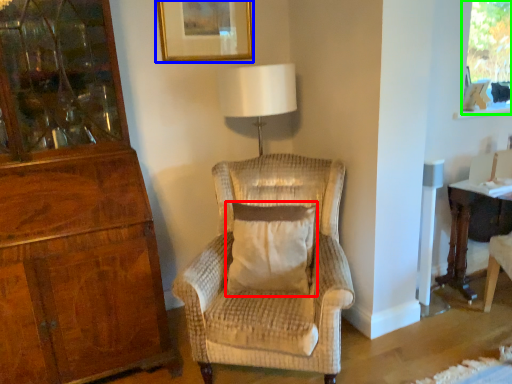
Question: Based on their relative distances, which object is nearer to pillow (highlighted by a red box)? Choose from picture frame (highlighted by a blue box) and window screen (highlighted by a green box).

Choices:
 (A) picture frame
 (B) window screen

Answer: (A)